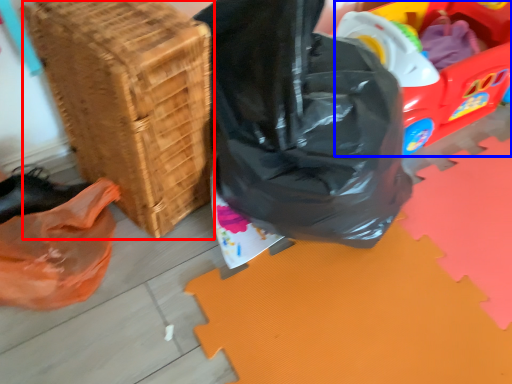
Question: Which of the following is the closest to the observer, basket (highlighted by a red box) or wagon (highlighted by a blue box)?

Choices:
 (A) basket
 (B) wagon

Answer: (A)